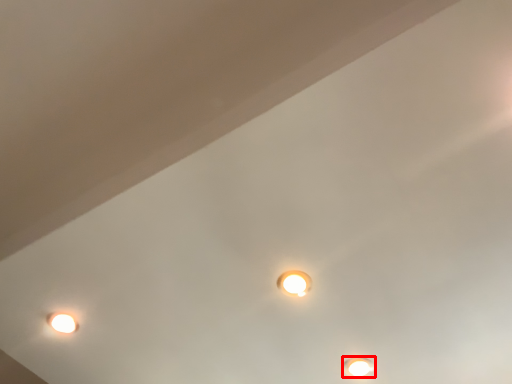
Question: From the image's perspective, what is the correct spatial relationship of lamp (annotated by the red box) in relation to lamp?

Choices:
 (A) above
 (B) below

Answer: (B)